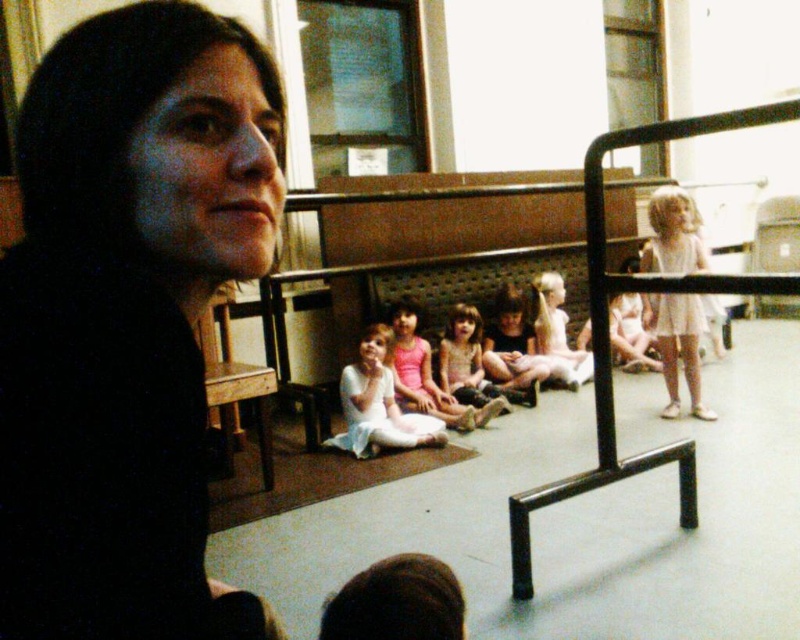
Which of these two, white satin dress at center or matte white ballet shoes at center, stands taller?

matte white ballet shoes at center

Consider the image. Does white satin dress at center have a greater width compared to matte white ballet shoes at center?

Correct, the width of white satin dress at center exceeds that of matte white ballet shoes at center.

The image size is (800, 640). In order to click on white satin dress at center in this screenshot , I will do `click(378, 404)`.

Who is taller, white cotton dress at right or smooth white dress at center?

Standing taller between the two is white cotton dress at right.

Does white cotton dress at right have a greater height compared to smooth white dress at center?

Yes.

You are a GUI agent. You are given a task and a screenshot of the screen. Output one action in this format:
    pyautogui.click(x=<x>, y=<y>)
    Task: Click on the white cotton dress at right
    
    Given the screenshot: What is the action you would take?
    pyautogui.click(x=680, y=348)

From the picture: Can you confirm if white satin dress at center is smaller than smooth white dress at center?

A: Yes.

Based on the photo, which is more to the left, white satin dress at center or smooth white dress at center?

white satin dress at center is more to the left.

Which is behind, point (382, 435) or point (476, 348)?

The point (476, 348) is more distant.

This screenshot has width=800, height=640. What are the coordinates of `white satin dress at center` in the screenshot? It's located at (378, 404).